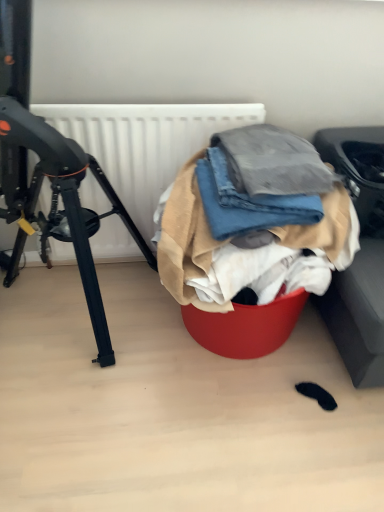
Question: In terms of width, does denim fabric at center, marked as the first clothing in a top-to-bottom arrangement, look wider or thinner when compared to black matte tripod at left?

Choices:
 (A) thin
 (B) wide

Answer: (A)

Question: In terms of height, does denim fabric at center, marked as the first clothing in a top-to-bottom arrangement, look taller or shorter compared to black matte tripod at left?

Choices:
 (A) tall
 (B) short

Answer: (B)

Question: Which is nearer to the white matte radiator at upper center?

Choices:
 (A) denim fabric at center, the 3th clothing when ordered from bottom to top
 (B) denim fabric at center, marked as the third clothing in a top-to-bottom arrangement
 (C) black matte tripod at left
 (D) denim fabric at center, which is the second clothing in top-to-bottom order

Answer: (C)

Question: Which object is the closest to the denim fabric at center, marked as the first clothing in a top-to-bottom arrangement?

Choices:
 (A) denim fabric at center, which is the second clothing in top-to-bottom order
 (B) black matte tripod at left
 (C) white matte radiator at upper center
 (D) denim fabric at center, which ranks as the first clothing in bottom-to-top order

Answer: (A)